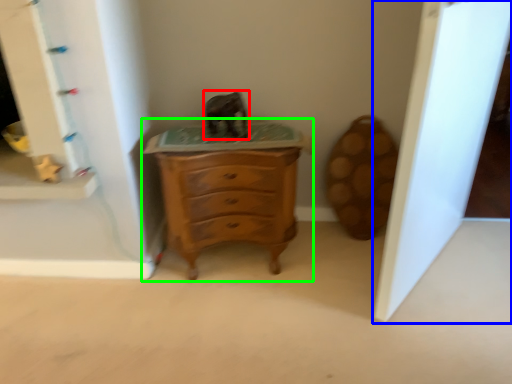
Question: Which object is the farthest from animal (highlighted by a red box)? Choose among these: glass door (highlighted by a blue box) or chest of drawers (highlighted by a green box).

Choices:
 (A) glass door
 (B) chest of drawers

Answer: (A)